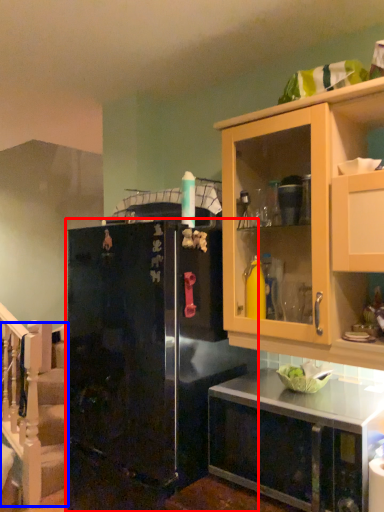
Question: Which object appears farthest to the camera in this image, refrigerator (highlighted by a red box) or stairwell (highlighted by a blue box)?

Choices:
 (A) refrigerator
 (B) stairwell

Answer: (B)